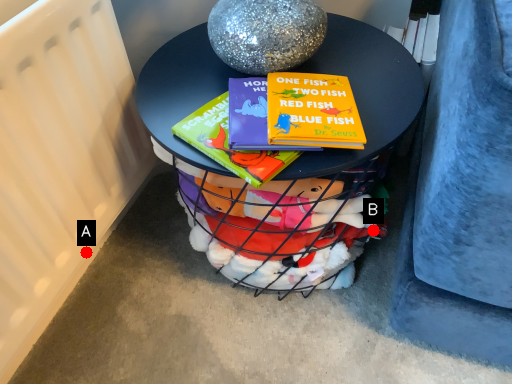
Question: Two points are circled on the image, labeled by A and B beside each circle. Which of the following is the farthest from the observer?

Choices:
 (A) A is further
 (B) B is further

Answer: (A)